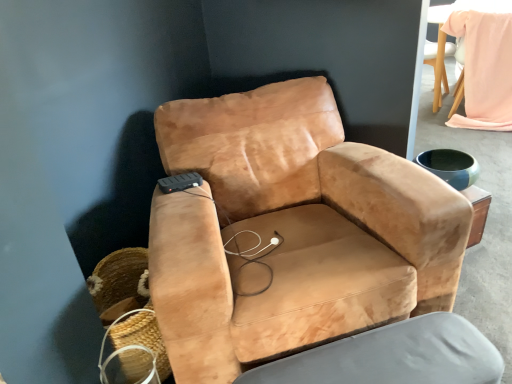
Question: Visually, is light pink fabric bean bag chair at upper right positioned to the left or to the right of woven straw basket at lower left?

Choices:
 (A) left
 (B) right

Answer: (B)

Question: Is light pink fabric bean bag chair at upper right inside or outside of woven straw basket at lower left?

Choices:
 (A) inside
 (B) outside

Answer: (B)

Question: Which is nearer to the light pink fabric bean bag chair at upper right?

Choices:
 (A) suede-like tan swivel chair at center
 (B) suede tan armchair at center
 (C) woven straw basket at lower left

Answer: (B)

Question: Which is nearer to the suede tan armchair at center?

Choices:
 (A) light pink fabric bean bag chair at upper right
 (B) woven straw basket at lower left
 (C) suede-like tan swivel chair at center

Answer: (C)